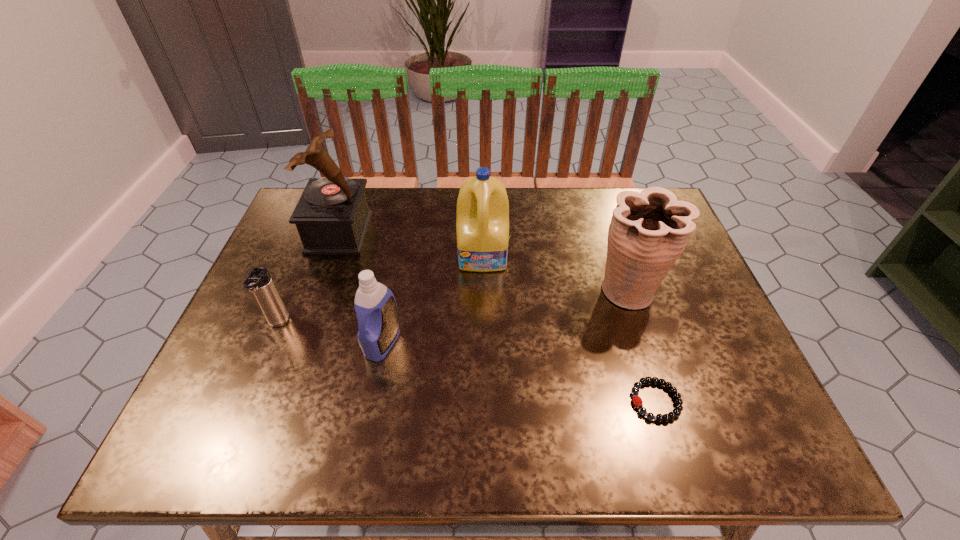
This screenshot has width=960, height=540. I want to click on empty space between the thermos bottle and the urn, so click(453, 307).

Where is `vacant area between the nearest object and the phonograph_record`? The width and height of the screenshot is (960, 540). vacant area between the nearest object and the phonograph_record is located at coordinates (497, 316).

Identify the location of free space between the tallest object and the shortest object. This screenshot has height=540, width=960. (497, 316).

This screenshot has width=960, height=540. I want to click on vacant space that is in between the farther detergent and the urn, so click(557, 273).

Where is `vacant region between the third shortest object and the nearest object`? vacant region between the third shortest object and the nearest object is located at coordinates (519, 372).

The height and width of the screenshot is (540, 960). In order to click on object that is the nearest to the bracelet in this screenshot , I will do `click(649, 230)`.

Select which object appears as the fourth closest to the shortest object. Please provide its 2D coordinates. Your answer should be formatted as a tuple, i.e. [(x, y)], where the tuple contains the x and y coordinates of a point satisfying the conditions above.

[(332, 216)]

Where is `vacant space that satisfies the following two spatial constraints: 1. at the horn opening of the urn; 2. on the right side of the tallest object`? vacant space that satisfies the following two spatial constraints: 1. at the horn opening of the urn; 2. on the right side of the tallest object is located at coordinates (319, 290).

Image resolution: width=960 pixels, height=540 pixels. Identify the location of free space that satisfies the following two spatial constraints: 1. on the label of the farther detergent; 2. on the right side of the urn. (484, 290).

Identify the location of free space that satisfies the following two spatial constraints: 1. on the back side of the bracelet; 2. on the left side of the urn. The image size is (960, 540). (621, 290).